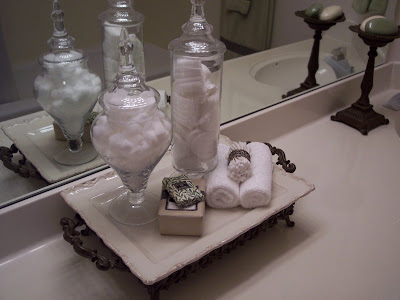
Where is `glass container of circular cotton wipe`? The height and width of the screenshot is (300, 400). glass container of circular cotton wipe is located at coordinates (198, 56).